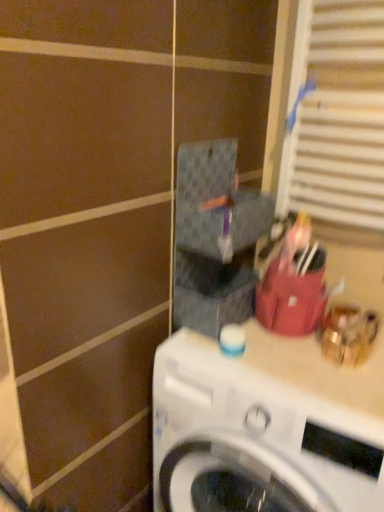
Locate an element on the screen. The image size is (384, 512). empty space that is ontop of white glossy washing machine at center (from a real-world perspective) is located at coordinates (297, 357).